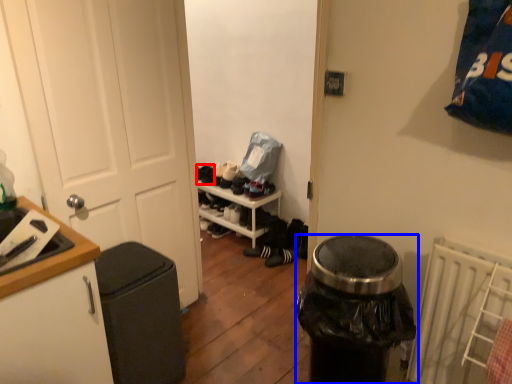
Question: Which point is closer to the camera, shoe (highlighted by a red box) or trash bin/can (highlighted by a blue box)?

Choices:
 (A) shoe
 (B) trash bin/can

Answer: (B)